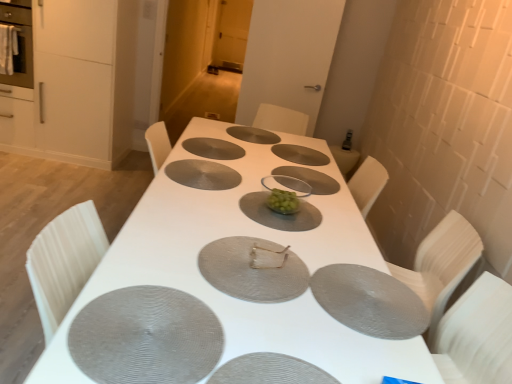
Find the location of a particular element. The height and width of the screenshot is (384, 512). free space above gray textured placemat at lower right, which is the sixth pizza pan in back-to-front order (from a real-world perspective) is located at coordinates (365, 291).